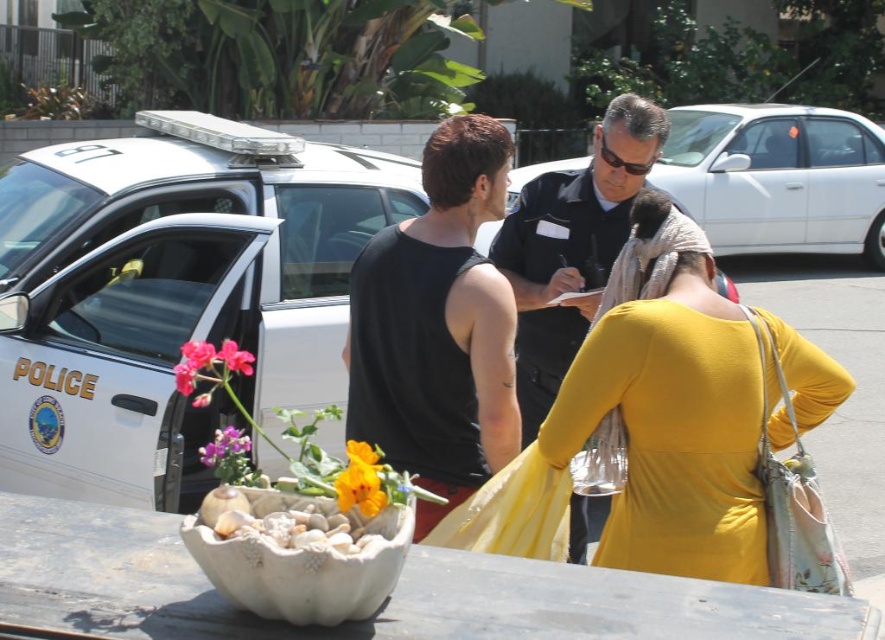
Question: Is black matte tank top at center positioned in front of black uniform at center?

Choices:
 (A) yes
 (B) no

Answer: (A)

Question: Among these points, which one is nearest to the camera?

Choices:
 (A) (431, 172)
 (B) (231, 472)

Answer: (B)

Question: Which point is closer to the camera taking this photo?

Choices:
 (A) (666, 173)
 (B) (198, 452)
 (C) (498, 273)

Answer: (C)

Question: Can you confirm if black matte tank top at center is positioned to the right of black uniform at center?

Choices:
 (A) no
 (B) yes

Answer: (A)

Question: Estimate the real-world distances between objects in this image. Which object is closer to the white matte picnic table at lower center?

Choices:
 (A) white glossy sedan at center
 (B) black matte tank top at center

Answer: (B)

Question: Can you confirm if black matte tank top at center is positioned to the right of matte pink flower at center?

Choices:
 (A) no
 (B) yes

Answer: (B)